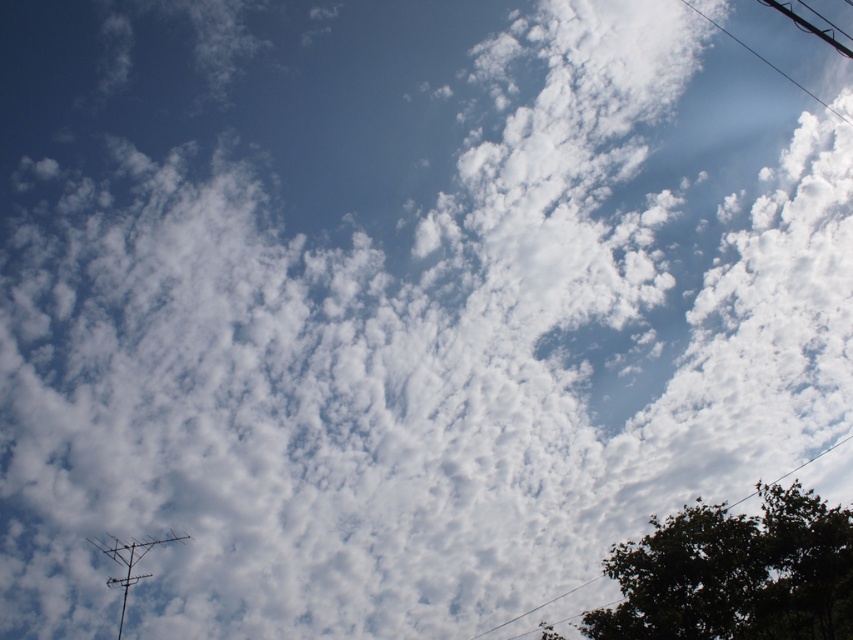
You are standing in front of the image and want to determine the relative positions of two points. Which point is closer to you, point (123, 580) or point (750, 49)?

Point (123, 580) is closer to the camera than point (750, 49).

You are standing in the middle of the image and want to look at both the dark green leafy tree at lower right and the metallic silver antenna at lower left. Which object will you need to look down more to see?

The metallic silver antenna at lower left is shorter than the dark green leafy tree at lower right, so you will need to look down more to see the metallic silver antenna at lower left.

You are standing in the middle of the image and looking towards the dark green leafy tree at lower right. Which direction should you turn to see the black wire at upper right?

The dark green leafy tree at lower right is positioned under the black wire at upper right, so you should look upward to see the black wire at upper right while facing the tree.